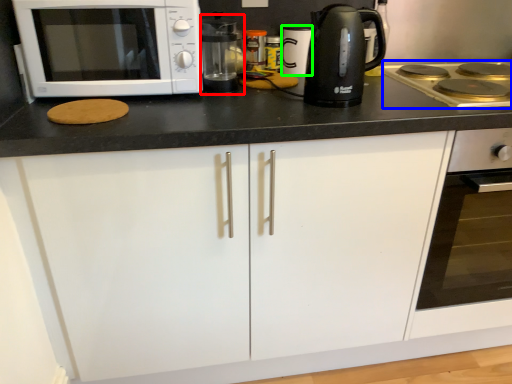
Question: Which is nearer to the coffee machine (highlighted by a red box)? gas stove (highlighted by a blue box) or appliance (highlighted by a green box).

Choices:
 (A) gas stove
 (B) appliance

Answer: (B)